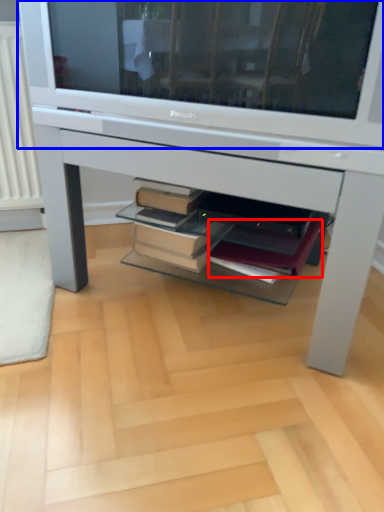
Question: Among these objects, which one is farthest to the camera, paperback book (highlighted by a red box) or television (highlighted by a blue box)?

Choices:
 (A) paperback book
 (B) television

Answer: (A)